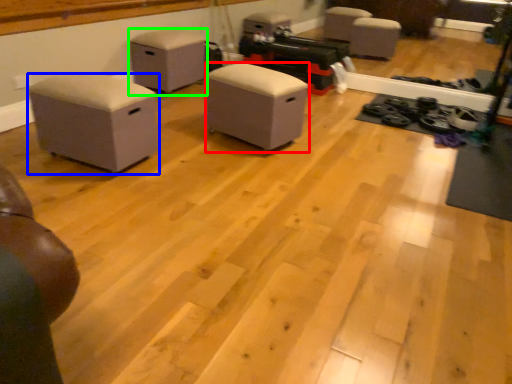
Question: Which is nearer to the furniture (highlighted by a red box)? furniture (highlighted by a blue box) or furniture (highlighted by a green box).

Choices:
 (A) furniture
 (B) furniture

Answer: (A)